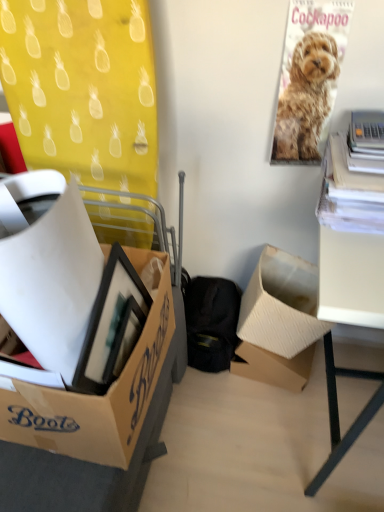
Where is `white matte desk at right`? The image size is (384, 512). white matte desk at right is located at coordinates (351, 276).

In order to click on cardboard box at left, which is the second box from front to back in this screenshot , I will do `click(96, 396)`.

From a real-world perspective, which is physically below, golden fur poster at upper right or cardboard box at center, marked as the 2th box in a back-to-front arrangement?

In real-world perspective, cardboard box at center, marked as the 2th box in a back-to-front arrangement, is lower.

From the image's perspective, between golden fur poster at upper right and cardboard box at center, marked as the 2th box in a back-to-front arrangement, who is located below?

cardboard box at center, marked as the 2th box in a back-to-front arrangement.

Would you say golden fur poster at upper right contains cardboard box at center, arranged as the third box when viewed from the front?

No, cardboard box at center, arranged as the third box when viewed from the front, is not inside golden fur poster at upper right.

Considering the sizes of golden fur poster at upper right and cardboard box at center, arranged as the third box when viewed from the front, in the image, is golden fur poster at upper right wider or thinner than cardboard box at center, arranged as the third box when viewed from the front,?

In the image, golden fur poster at upper right appears to be more narrow than cardboard box at center, arranged as the third box when viewed from the front.

Is the depth of cardboard box at center, marked as the 2th box in a back-to-front arrangement, greater than that of cardboard box at left, placed as the 1th box when sorted from front to back?

Yes, the depth of cardboard box at center, marked as the 2th box in a back-to-front arrangement, is greater than that of cardboard box at left, placed as the 1th box when sorted from front to back.

Is cardboard box at center, arranged as the third box when viewed from the front, spatially inside cardboard box at left, placed as the 1th box when sorted from front to back, or outside of it?

cardboard box at center, arranged as the third box when viewed from the front, is spatially situated outside cardboard box at left, placed as the 1th box when sorted from front to back.

Which of these two, cardboard box at center, arranged as the third box when viewed from the front, or cardboard box at left, placed as the 1th box when sorted from front to back, is bigger?

cardboard box at center, arranged as the third box when viewed from the front.

Considering the relative sizes of cardboard box at center, arranged as the third box when viewed from the front, and cardboard box at left, positioned as the 4th box in back-to-front order, in the image provided, is cardboard box at center, arranged as the third box when viewed from the front, wider than cardboard box at left, positioned as the 4th box in back-to-front order,?

Correct, the width of cardboard box at center, arranged as the third box when viewed from the front, exceeds that of cardboard box at left, positioned as the 4th box in back-to-front order.

Is cardboard box at left, placed as the 1th box when sorted from front to back, shorter than white matte desk at right?

Yes.

Does cardboard box at left, positioned as the 4th box in back-to-front order, touch white matte desk at right?

No, cardboard box at left, positioned as the 4th box in back-to-front order, is not touching white matte desk at right.

Is cardboard box at left, placed as the 1th box when sorted from front to back, to the left of white matte desk at right from the viewer's perspective?

Yes, cardboard box at left, placed as the 1th box when sorted from front to back, is to the left of white matte desk at right.

Between white matte desk at right and cardboard box at left, which is counted as the third box, starting from the back, which one has smaller size?

Smaller between the two is cardboard box at left, which is counted as the third box, starting from the back.

Which is nearer, (341, 295) or (129, 409)?

The point (341, 295) is closer.

Would you say white matte desk at right contains cardboard box at left, which is the second box from front to back?

Definitely not — cardboard box at left, which is the second box from front to back, is not inside white matte desk at right.

Is the depth of cardboard box at left, which is the second box from front to back, greater than that of cardboard box at left, positioned as the 4th box in back-to-front order?

Yes, it is behind cardboard box at left, positioned as the 4th box in back-to-front order.

Between cardboard box at left, which is counted as the third box, starting from the back, and cardboard box at left, placed as the 1th box when sorted from front to back, which one has larger size?

Bigger between the two is cardboard box at left, which is counted as the third box, starting from the back.

Is point (88, 443) more distant than point (47, 225)?

Yes, point (88, 443) is behind point (47, 225).

In order to click on box that appears in front of the cardboard box at left, which is the second box from front to back in this screenshot , I will do `click(52, 282)`.

Consider the image. Is white matte desk at right oriented away from golden fur poster at upper right?

white matte desk at right is not turned away from golden fur poster at upper right.

Is white matte desk at right next to golden fur poster at upper right and touching it?

No, white matte desk at right is not touching golden fur poster at upper right.

From the image's perspective, who appears lower, white matte desk at right or golden fur poster at upper right?

From the image's view, white matte desk at right is below.

Looking at this image, is the depth of white matte desk at right greater than that of golden fur poster at upper right?

No, white matte desk at right is closer to the viewer.

Consider the image. How distant is cardboard box at left, which is counted as the third box, starting from the back, from cardboard box at center, which is the fourth box in front-to-back order?

They are 24.40 inches apart.

What's the angular difference between cardboard box at left, which is counted as the third box, starting from the back, and cardboard box at center, which is the fourth box in front-to-back order,'s facing directions?

The angular difference between cardboard box at left, which is counted as the third box, starting from the back, and cardboard box at center, which is the fourth box in front-to-back order, is 96.2 degrees.

Is cardboard box at left, which is the second box from front to back, far from cardboard box at center, which is the fourth box in front-to-back order?

No, there isn't a large distance between cardboard box at left, which is the second box from front to back, and cardboard box at center, which is the fourth box in front-to-back order.

From a real-world perspective, is cardboard box at left, which is counted as the third box, starting from the back, on top of cardboard box at center, arranged as the 1th box when viewed from the back?

Correct, in the physical world, cardboard box at left, which is counted as the third box, starting from the back, is higher than cardboard box at center, arranged as the 1th box when viewed from the back.

Where is `dog above the cardboard box at center, arranged as the third box when viewed from the front (from a real-world perspective)`? The image size is (384, 512). dog above the cardboard box at center, arranged as the third box when viewed from the front (from a real-world perspective) is located at coordinates (306, 98).

Identify the location of the 2nd box directly beneath the cardboard box at left, positioned as the 4th box in back-to-front order (from a real-world perspective). The height and width of the screenshot is (512, 384). (281, 305).

Looking at the image, which one is located further to cardboard box at center, arranged as the 1th box when viewed from the back, cardboard box at center, marked as the 2th box in a back-to-front arrangement, or white matte desk at right?

white matte desk at right lies further to cardboard box at center, arranged as the 1th box when viewed from the back, than the other object.

Looking at the image, which one is located further to white matte desk at right, golden fur poster at upper right or cardboard box at left, positioned as the 4th box in back-to-front order?

Among the two, cardboard box at left, positioned as the 4th box in back-to-front order, is located further to white matte desk at right.

When comparing their distances from cardboard box at left, positioned as the 4th box in back-to-front order, does white matte desk at right or cardboard box at left, which is counted as the third box, starting from the back, seem further?

white matte desk at right lies further to cardboard box at left, positioned as the 4th box in back-to-front order, than the other object.

Looking at the image, which one is located closer to cardboard box at center, marked as the 2th box in a back-to-front arrangement, cardboard box at center, which is the fourth box in front-to-back order, or golden fur poster at upper right?

cardboard box at center, which is the fourth box in front-to-back order, lies closer to cardboard box at center, marked as the 2th box in a back-to-front arrangement, than the other object.

Which object lies nearer to the anchor point cardboard box at center, marked as the 2th box in a back-to-front arrangement, white matte desk at right or golden fur poster at upper right?

white matte desk at right is positioned closer to the anchor cardboard box at center, marked as the 2th box in a back-to-front arrangement.

Based on their spatial positions, is cardboard box at left, placed as the 1th box when sorted from front to back, or white matte desk at right further from cardboard box at left, which is the second box from front to back?

The object further to cardboard box at left, which is the second box from front to back, is white matte desk at right.

Looking at the image, which one is located further to cardboard box at center, which is the fourth box in front-to-back order, cardboard box at left, placed as the 1th box when sorted from front to back, or golden fur poster at upper right?

Among the two, cardboard box at left, placed as the 1th box when sorted from front to back, is located further to cardboard box at center, which is the fourth box in front-to-back order.

When comparing their distances from cardboard box at center, arranged as the third box when viewed from the front, does cardboard box at left, placed as the 1th box when sorted from front to back, or cardboard box at center, which is the fourth box in front-to-back order, seem closer?

cardboard box at center, which is the fourth box in front-to-back order, lies closer to cardboard box at center, arranged as the third box when viewed from the front, than the other object.

I want to click on box between white matte desk at right and cardboard box at center, arranged as the 1th box when viewed from the back, from front to back, so click(281, 305).

The height and width of the screenshot is (512, 384). What are the coordinates of `box located between cardboard box at left, positioned as the 4th box in back-to-front order, and cardboard box at center, arranged as the third box when viewed from the front, in the depth direction` in the screenshot? It's located at (96, 396).

This screenshot has height=512, width=384. Identify the location of desk between golden fur poster at upper right and cardboard box at center, arranged as the 1th box when viewed from the back, in the vertical direction. (351, 276).

The width and height of the screenshot is (384, 512). Find the location of `desk located between cardboard box at left, which is counted as the third box, starting from the back, and cardboard box at center, which is the fourth box in front-to-back order, in the depth direction`. desk located between cardboard box at left, which is counted as the third box, starting from the back, and cardboard box at center, which is the fourth box in front-to-back order, in the depth direction is located at coordinates (351, 276).